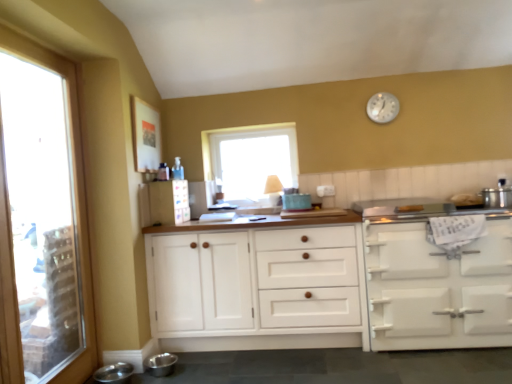
Question: Can you confirm if stainless steel bowls at lower left, positioned as the first appliance in front-to-back order, is shorter than clear glass window at left, which is the second window from right to left?

Choices:
 (A) yes
 (B) no

Answer: (A)

Question: Is stainless steel bowls at lower left, the 1th appliance from the bottom, bigger than clear glass window at left, which ranks as the 1th window in left-to-right order?

Choices:
 (A) yes
 (B) no

Answer: (B)

Question: Considering the relative positions of stainless steel bowls at lower left, positioned as the first appliance in front-to-back order, and clear glass window at left, which ranks as the second window in back-to-front order, in the image provided, is stainless steel bowls at lower left, positioned as the first appliance in front-to-back order, to the right of clear glass window at left, which ranks as the second window in back-to-front order, from the viewer's perspective?

Choices:
 (A) yes
 (B) no

Answer: (A)

Question: Considering the relative positions of stainless steel bowls at lower left, which is the 3th appliance from back to front, and clear glass window at left, which is the second window from right to left, in the image provided, is stainless steel bowls at lower left, which is the 3th appliance from back to front, to the left of clear glass window at left, which is the second window from right to left, from the viewer's perspective?

Choices:
 (A) yes
 (B) no

Answer: (B)

Question: Does stainless steel bowls at lower left, which ranks as the third appliance in right-to-left order, have a greater width compared to clear glass window at left, which ranks as the second window in back-to-front order?

Choices:
 (A) no
 (B) yes

Answer: (B)

Question: Is point (115, 375) positioned closer to the camera than point (58, 91)?

Choices:
 (A) closer
 (B) farther

Answer: (A)

Question: From their relative heights in the image, would you say stainless steel bowls at lower left, positioned as the 3th appliance in top-to-bottom order, is taller or shorter than clear glass window at left, acting as the 1th window starting from the front?

Choices:
 (A) short
 (B) tall

Answer: (A)

Question: From the image's perspective, is stainless steel bowls at lower left, which ranks as the third appliance in right-to-left order, positioned above or below clear glass window at left, acting as the 1th window starting from the front?

Choices:
 (A) below
 (B) above

Answer: (A)

Question: From a real-world perspective, is stainless steel bowls at lower left, the 1th appliance from the bottom, physically located above or below clear glass window at left, acting as the 1th window starting from the front?

Choices:
 (A) above
 (B) below

Answer: (B)

Question: Based on their sizes in the image, would you say silver metallic clock at upper center is bigger or smaller than stainless steel pot at right, the first appliance when ordered from right to left?

Choices:
 (A) big
 (B) small

Answer: (B)

Question: Considering the positions of silver metallic clock at upper center and stainless steel pot at right, the first appliance viewed from the top, in the image, is silver metallic clock at upper center wider or thinner than stainless steel pot at right, the first appliance viewed from the top,?

Choices:
 (A) wide
 (B) thin

Answer: (B)

Question: In terms of height, does silver metallic clock at upper center look taller or shorter compared to stainless steel pot at right, the 2th appliance in the back-to-front sequence?

Choices:
 (A) short
 (B) tall

Answer: (B)

Question: Which is correct: silver metallic clock at upper center is inside stainless steel pot at right, the first appliance viewed from the top, or outside of it?

Choices:
 (A) outside
 (B) inside

Answer: (A)

Question: Considering the positions of white matte oven at right, which ranks as the 1th cabinetry in right-to-left order, and stainless steel pot at right, acting as the third appliance starting from the left, in the image, is white matte oven at right, which ranks as the 1th cabinetry in right-to-left order, bigger or smaller than stainless steel pot at right, acting as the third appliance starting from the left,?

Choices:
 (A) big
 (B) small

Answer: (A)

Question: In terms of height, does white matte oven at right, which ranks as the 1th cabinetry in right-to-left order, look taller or shorter compared to stainless steel pot at right, acting as the third appliance starting from the left?

Choices:
 (A) tall
 (B) short

Answer: (A)